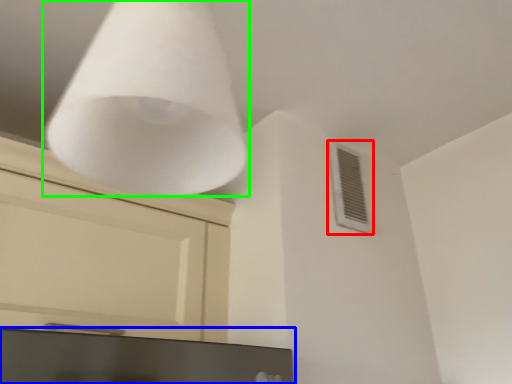
Question: Which is nearer to the air conditioning (highlighted by a red box)? computer monitor (highlighted by a blue box) or lamp (highlighted by a green box).

Choices:
 (A) computer monitor
 (B) lamp

Answer: (A)